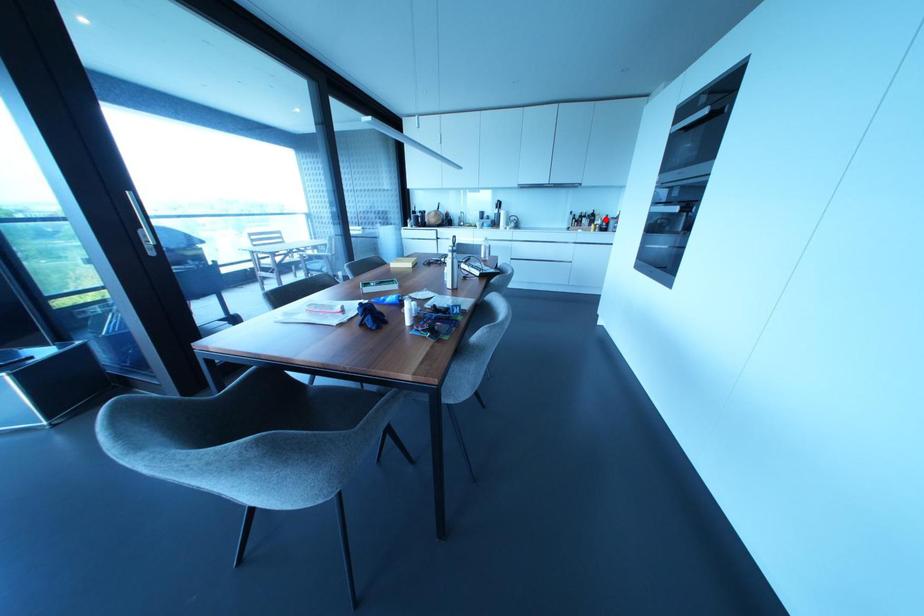
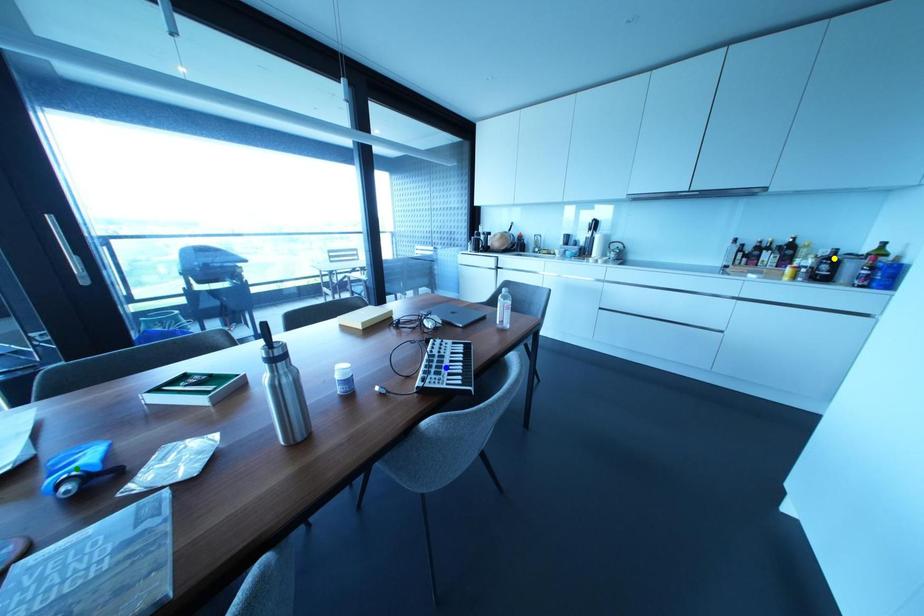
Question: I am providing you with two images of the same scene from different viewpoints. A red point is marked on the first image. You are given multiple points on the second image. Which mark in image 2 goes with the point in image 1?

Choices:
 (A) blue point
 (B) yellow point
 (C) green point

Answer: (B)